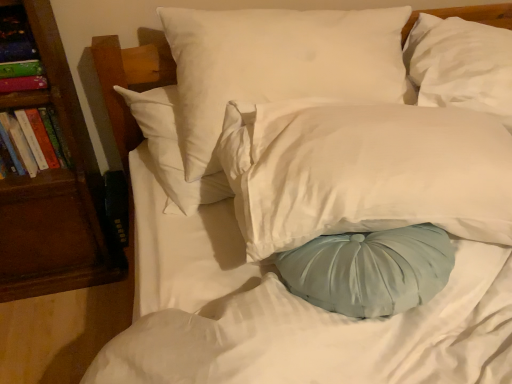
Question: Considering the relative sizes of hardcover book at left, the 1th book when ordered from bottom to top, and brown wood bookshelf at left in the image provided, is hardcover book at left, the 1th book when ordered from bottom to top, thinner than brown wood bookshelf at left?

Choices:
 (A) no
 (B) yes

Answer: (B)

Question: From the image's perspective, is hardcover book at left, the 1th book when ordered from bottom to top, on brown wood bookshelf at left?

Choices:
 (A) no
 (B) yes

Answer: (B)

Question: Considering the relative sizes of hardcover book at left, arranged as the 2th book when viewed from the top, and brown wood bookshelf at left in the image provided, is hardcover book at left, arranged as the 2th book when viewed from the top, smaller than brown wood bookshelf at left?

Choices:
 (A) yes
 (B) no

Answer: (A)

Question: Is hardcover book at left, the 1th book when ordered from bottom to top, bigger than brown wood bookshelf at left?

Choices:
 (A) no
 (B) yes

Answer: (A)

Question: Is the position of hardcover book at left, arranged as the 2th book when viewed from the top, less distant than that of brown wood bookshelf at left?

Choices:
 (A) no
 (B) yes

Answer: (A)

Question: Considering the relative positions of hardcover book at left, arranged as the 2th book when viewed from the top, and white satin pillow at center, the second pillow viewed from the right, in the image provided, is hardcover book at left, arranged as the 2th book when viewed from the top, to the left or to the right of white satin pillow at center, the second pillow viewed from the right,?

Choices:
 (A) right
 (B) left

Answer: (B)

Question: From their relative heights in the image, would you say hardcover book at left, arranged as the 2th book when viewed from the top, is taller or shorter than white satin pillow at center, the second pillow viewed from the right?

Choices:
 (A) short
 (B) tall

Answer: (A)

Question: Considering their positions, is hardcover book at left, arranged as the 2th book when viewed from the top, located in front of or behind white satin pillow at center, the second pillow viewed from the right?

Choices:
 (A) front
 (B) behind

Answer: (B)

Question: Which is correct: hardcover book at left, the 1th book when ordered from bottom to top, is inside white satin pillow at center, arranged as the 2th pillow when viewed from the left, or outside of it?

Choices:
 (A) inside
 (B) outside

Answer: (B)

Question: From their relative heights in the image, would you say white smooth pillow at upper center, the 1th pillow in the left-to-right sequence, is taller or shorter than hardcover book at left, arranged as the 2th book when viewed from the top?

Choices:
 (A) tall
 (B) short

Answer: (A)

Question: Considering the positions of white smooth pillow at upper center, the 1th pillow in the left-to-right sequence, and hardcover book at left, the 1th book when ordered from bottom to top, in the image, is white smooth pillow at upper center, the 1th pillow in the left-to-right sequence, bigger or smaller than hardcover book at left, the 1th book when ordered from bottom to top,?

Choices:
 (A) big
 (B) small

Answer: (A)

Question: From a real-world perspective, relative to hardcover book at left, arranged as the 2th book when viewed from the top, is white smooth pillow at upper center, the 3th pillow when ordered from right to left, vertically above or below?

Choices:
 (A) above
 (B) below

Answer: (A)

Question: Is white smooth pillow at upper center, the 3th pillow when ordered from right to left, inside or outside of hardcover book at left, arranged as the 2th book when viewed from the top?

Choices:
 (A) inside
 (B) outside

Answer: (B)

Question: Based on their sizes in the image, would you say multicolored paper book at left, the 2th book ordered from the bottom, is bigger or smaller than white smooth pillow at upper center, the 1th pillow in the left-to-right sequence?

Choices:
 (A) small
 (B) big

Answer: (A)

Question: From a real-world perspective, is multicolored paper book at left, the 2th book ordered from the bottom, physically located above or below white smooth pillow at upper center, the 1th pillow in the left-to-right sequence?

Choices:
 (A) below
 (B) above

Answer: (B)